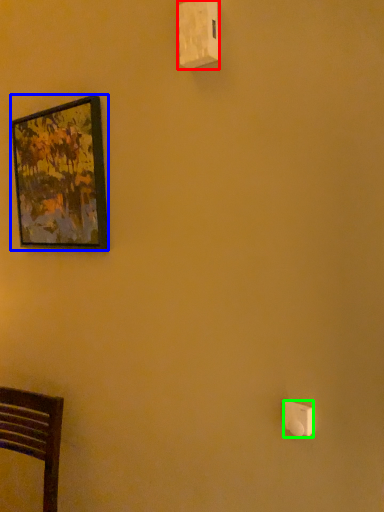
Question: Considering the real-world distances, which object is farthest from light switch (highlighted by a red box)? picture frame (highlighted by a blue box) or light switch (highlighted by a green box)?

Choices:
 (A) picture frame
 (B) light switch

Answer: (B)